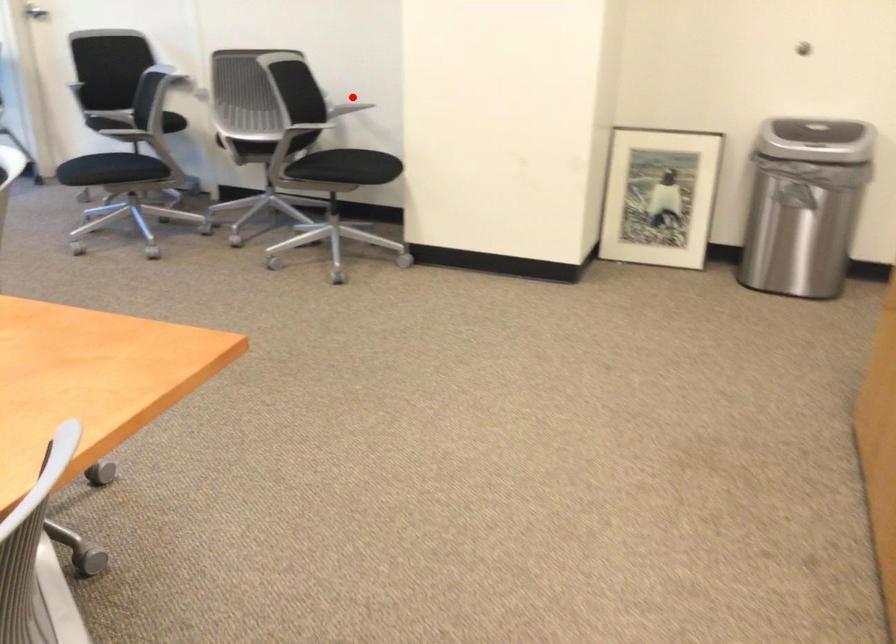
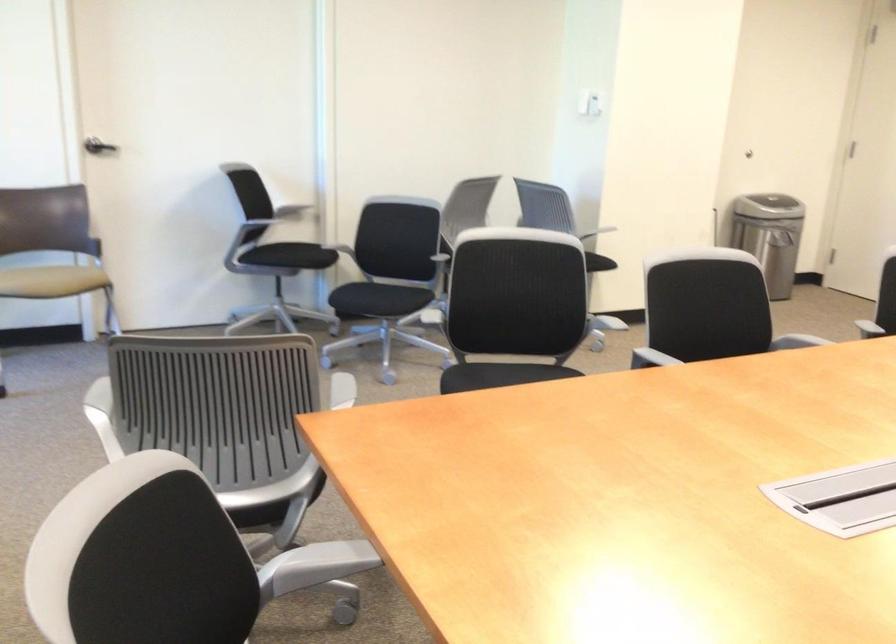
Question: I am providing you with two images of the same scene from different viewpoints. A red point is marked on the first image. Is the red point's position out of view in image 2?

Choices:
 (A) Yes
 (B) No

Answer: (A)